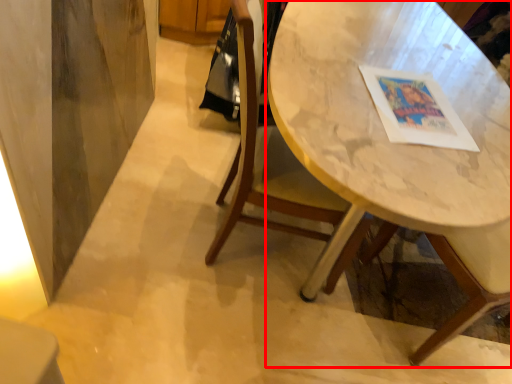
Question: In this image, where is table (annotated by the red box) located relative to chair?

Choices:
 (A) left
 (B) right

Answer: (B)